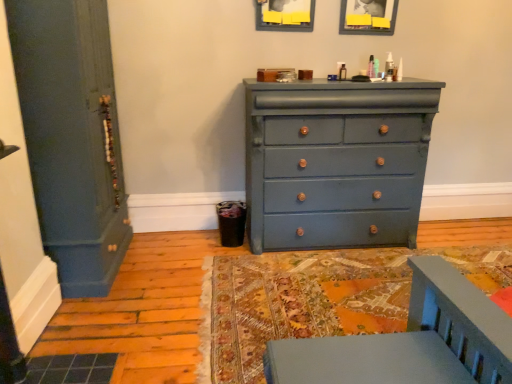
Question: Considering the positions of matte wooden picture frame at upper center, positioned as the 1th picture frame in right-to-left order, and matte blue dresser at center in the image, is matte wooden picture frame at upper center, positioned as the 1th picture frame in right-to-left order, wider or thinner than matte blue dresser at center?

Choices:
 (A) wide
 (B) thin

Answer: (B)

Question: From a real-world perspective, relative to matte blue dresser at center, is matte wooden picture frame at upper center, positioned as the second picture frame in left-to-right order, vertically above or below?

Choices:
 (A) below
 (B) above

Answer: (B)

Question: Which object is the farthest from the matte wooden picture frame at upper center, positioned as the 1th picture frame in right-to-left order?

Choices:
 (A) matte blue door at left
 (B) matte gray picture frame at upper center, positioned as the second picture frame in right-to-left order
 (C) matte blue dresser at center

Answer: (A)

Question: Which is nearer to the matte blue door at left?

Choices:
 (A) matte gray picture frame at upper center, acting as the first picture frame starting from the left
 (B) matte wooden picture frame at upper center, positioned as the 1th picture frame in right-to-left order
 (C) matte blue dresser at center

Answer: (C)